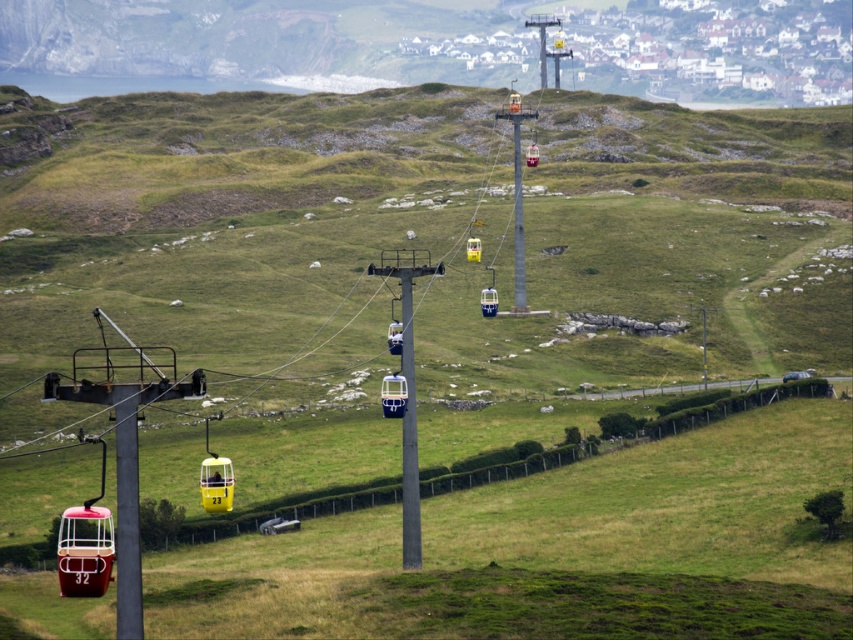
Does metallic cable car at center have a lesser width compared to metallic gray cable car pole at center?

Yes, metallic cable car at center is thinner than metallic gray cable car pole at center.

How far apart are metallic cable car at center and metallic gray cable car pole at center?

The distance of metallic cable car at center from metallic gray cable car pole at center is 73.39 meters.

The image size is (853, 640). What are the coordinates of `metallic cable car at center` in the screenshot? It's located at (409, 435).

Does metallic cable car pole at left appear on the left side of metallic cable car at center?

Indeed, metallic cable car pole at left is positioned on the left side of metallic cable car at center.

Can you confirm if metallic cable car pole at left is shorter than metallic cable car at center?

Yes, metallic cable car pole at left is shorter than metallic cable car at center.

Who is more distant from viewer, (132, 412) or (409, 320)?

The point (409, 320) is behind.

Identify the location of metallic cable car pole at left. (126, 515).

Is metallic cable car pole at left further to the viewer compared to metallic gray cable car pole at center?

No, it is in front of metallic gray cable car pole at center.

Is metallic cable car pole at left below metallic gray cable car pole at center?

Yes.

Does point (132, 406) lie in front of point (521, 236)?

Yes, it is.

Where is `metallic cable car pole at left`? metallic cable car pole at left is located at coordinates (126, 515).